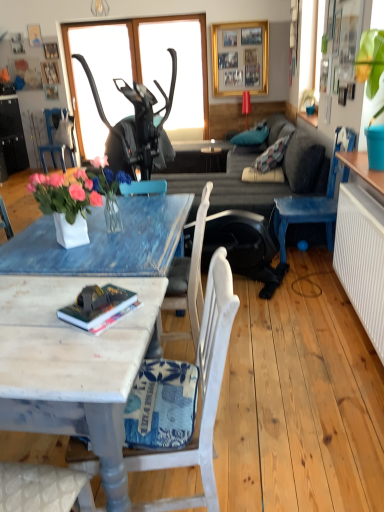
Where is `free space to the left of hardcover book at center`? Image resolution: width=384 pixels, height=512 pixels. free space to the left of hardcover book at center is located at coordinates (28, 330).